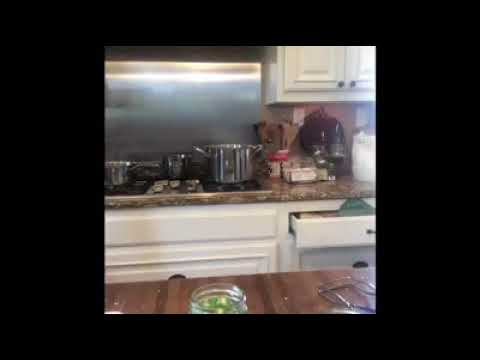
This screenshot has height=360, width=480. In order to click on coffee maker in this screenshot , I will do `click(329, 125)`.